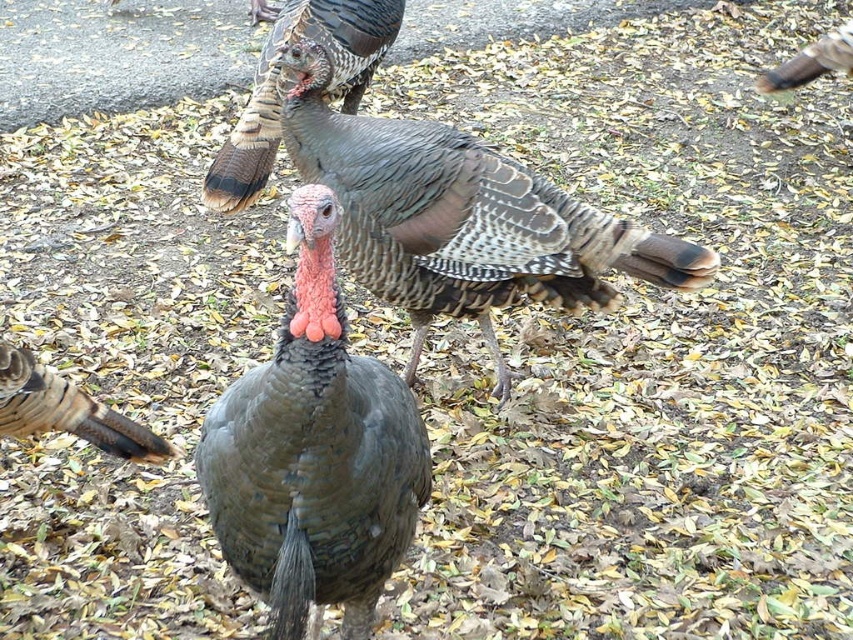
You are a photographer trying to capture a clear photo of the speckled feathered turkey at center and the speckled feathered turkey at lower left. Which turkey is closer to your camera lens?

The speckled feathered turkey at center is closer to the camera lens because it is further to the viewer than the speckled feathered turkey at lower left.

You are a photographer trying to capture a photo of the gray matte turkey at center and the speckled feathered turkey at lower left. Based on their positions, which turkey is closer to the camera?

The gray matte turkey at center is closer to the camera because it is positioned below the speckled feathered turkey at lower left, indicating it is in the foreground.

You are a wildlife photographer trying to capture a closeup shot of the speckled feathered turkey at center and the speckled feathered turkey at lower left. Since you want to focus on their feather details, which turkey would require you to step closer to get a clear shot?

The speckled feathered turkey at lower left is smaller in size, so you would need to step closer to capture its feather details clearly.